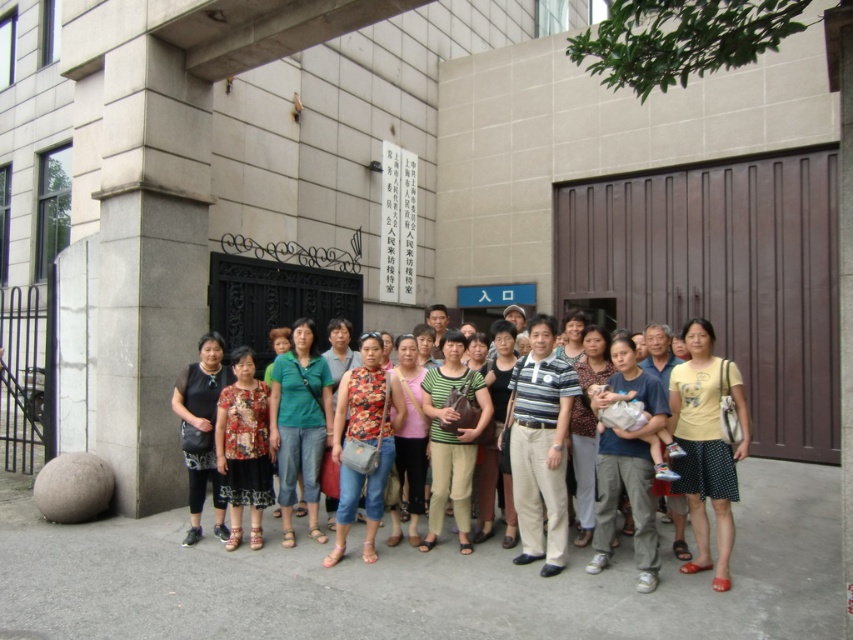
Is yellow cotton shirt at center closer to the viewer compared to green matte shirt at center?

Yes, it is in front of green matte shirt at center.

Which of these two, yellow cotton shirt at center or green matte shirt at center, stands taller?

Standing taller between the two is yellow cotton shirt at center.

Does point (730, 484) come closer to viewer compared to point (460, 518)?

Yes, point (730, 484) is in front of point (460, 518).

Where is `yellow cotton shirt at center`? yellow cotton shirt at center is located at coordinates (706, 444).

Who is shorter, printed fabric blouse at center or matte green tank top at center?

printed fabric blouse at center is shorter.

Who is more distant from viewer, (228,468) or (399,532)?

Positioned behind is point (399,532).

Image resolution: width=853 pixels, height=640 pixels. Find the location of `printed fabric blouse at center`. printed fabric blouse at center is located at coordinates (x=244, y=448).

Based on the photo, is printed fabric tank top at center closer to the viewer compared to green matte shirt at center?

That is True.

Identify the location of printed fabric tank top at center. The width and height of the screenshot is (853, 640). (364, 442).